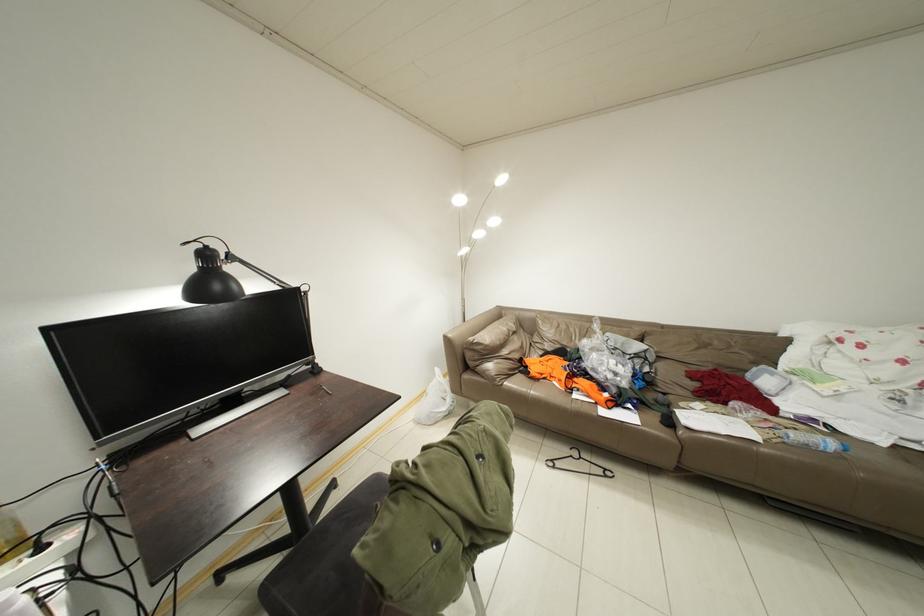
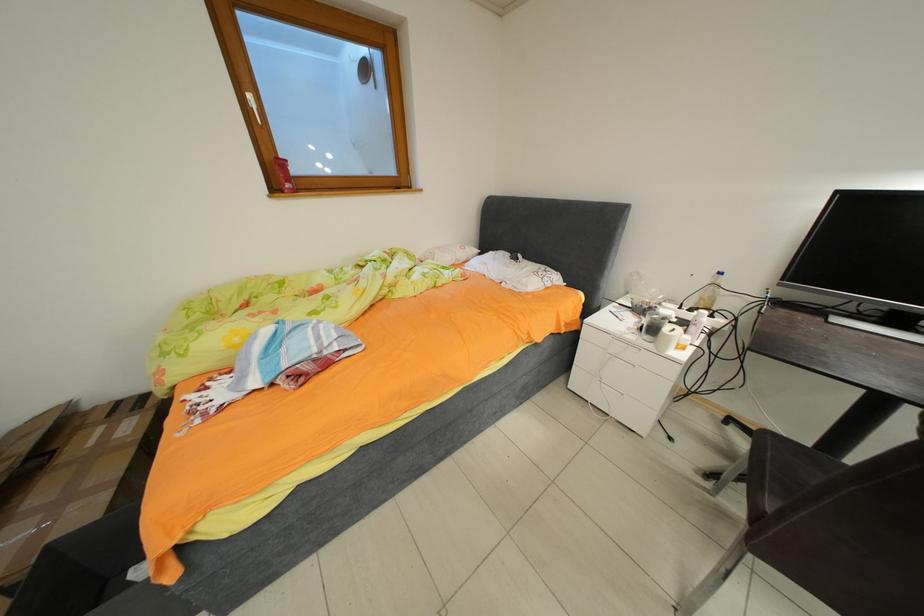
The images are taken continuously from a first-person perspective. In which direction is your viewpoint rotating?

The camera's rotation is toward left-down.